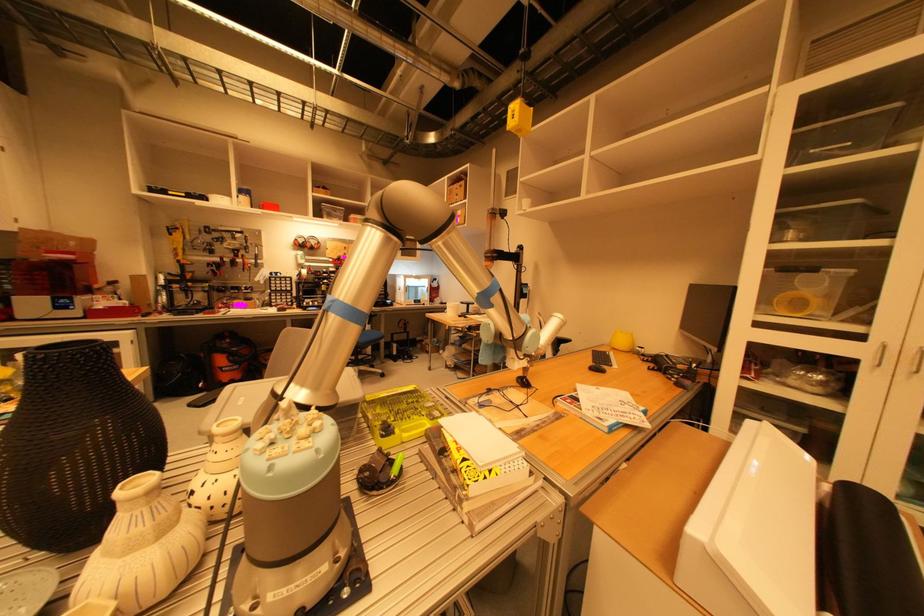
You are a GUI agent. You are given a task and a screenshot of the screen. Output one action in this format:
    pyautogui.click(x=<x>, y=<y>)
    Task: Click on the black computer mouse
    Image resolution: width=924 pixels, height=616 pixels.
    Given the screenshot: What is the action you would take?
    pyautogui.click(x=597, y=368)